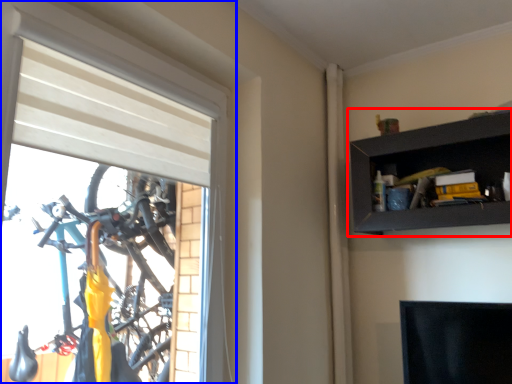
Question: Among these objects, which one is farthest to the camera, shelf (highlighted by a red box) or window (highlighted by a blue box)?

Choices:
 (A) shelf
 (B) window

Answer: (A)